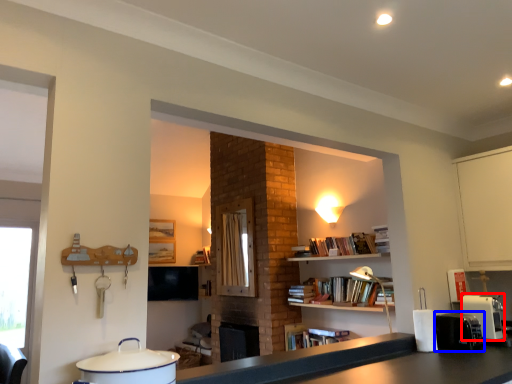
Question: Among these objects, which one is nearest to the camera, coffee machine (highlighted by a red box) or appliance (highlighted by a blue box)?

Choices:
 (A) coffee machine
 (B) appliance

Answer: (B)